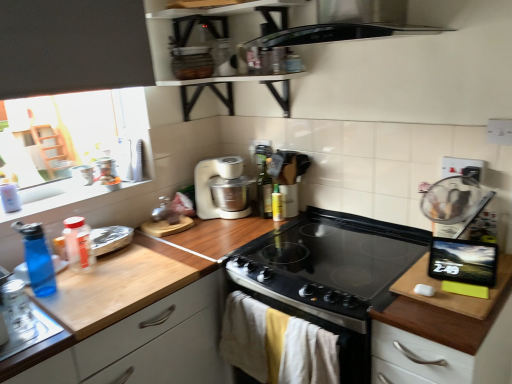
Where is `blank space above wooden cutting board at right (from a real-world perspective)`? blank space above wooden cutting board at right (from a real-world perspective) is located at coordinates (453, 293).